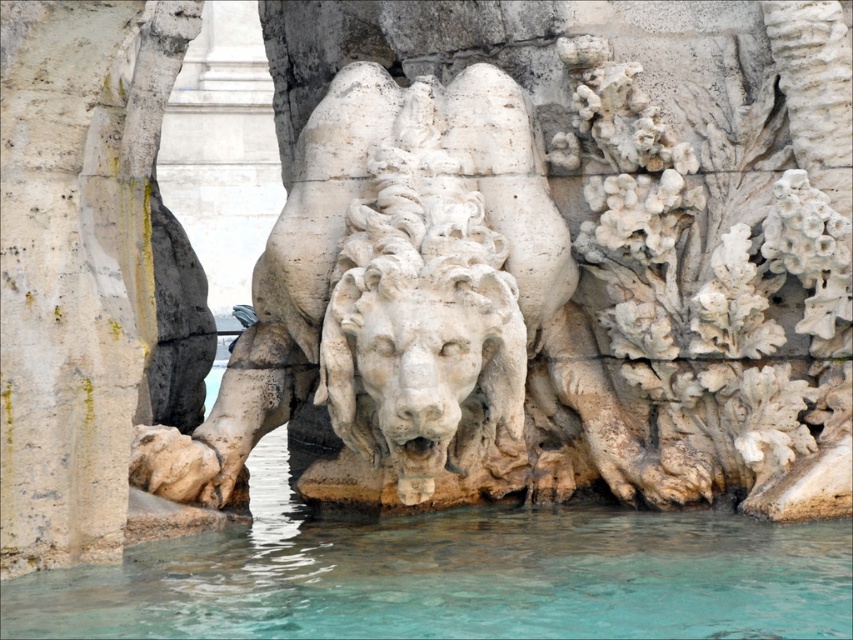
You are standing in front of the fountain and see the point at coordinates (x=456, y=579). What is located at that point?

The point at coordinates (x=456, y=579) is on clear water at lower center.

You are an architect designing a new fountain and want to ensure the water flow is visible. Given the scene, which object takes up more space in the image between the clear water at lower center and the white stone pillar at left?

The white stone pillar at left occupies more space in the image than the clear water at lower center, as the clear water at lower center occupies less space than white stone pillar at left.